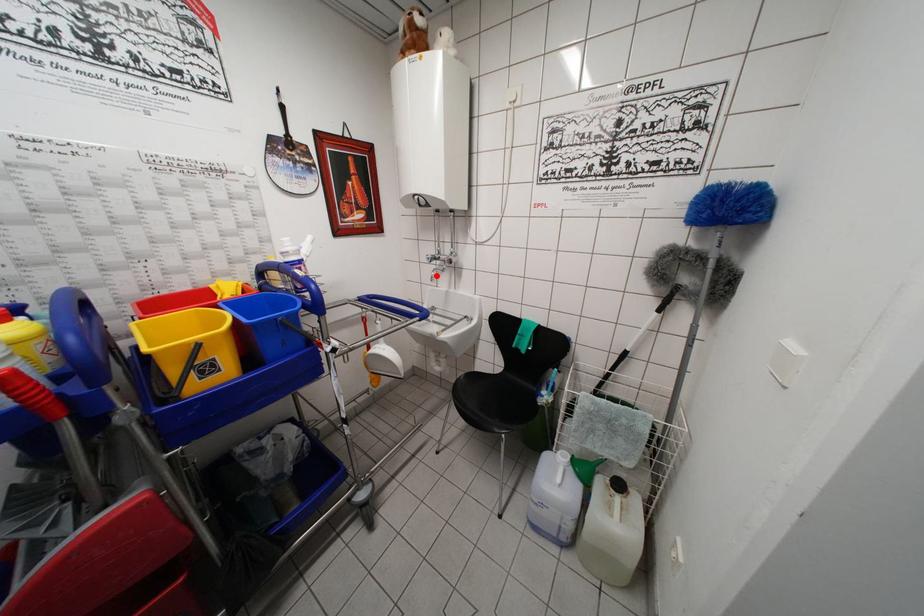
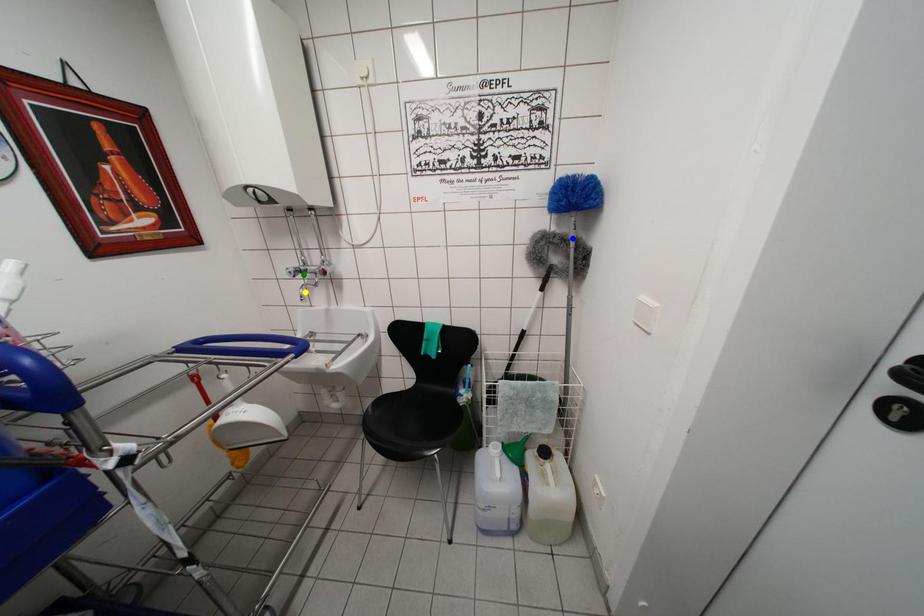
Question: I am providing you with two images of the same scene from different viewpoints. A red point is marked on the first image. You are given multiple points on the second image. Can you choose the point in image 2 that corresponds to the point in image 1?

Choices:
 (A) green point
 (B) blue point
 (C) yellow point

Answer: (C)